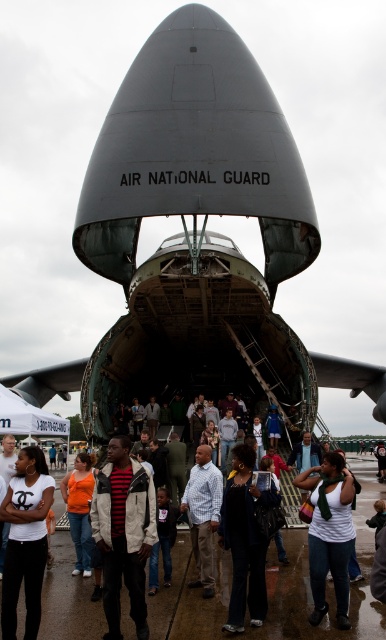
Question: Does white cotton t-shirt at center have a lesser width compared to orange fabric shirt at lower left?

Choices:
 (A) no
 (B) yes

Answer: (A)

Question: Can you confirm if metallic gray aircraft at center is positioned to the left of striped knit sweater at center?

Choices:
 (A) no
 (B) yes

Answer: (A)

Question: Which object appears farthest from the camera in this image?

Choices:
 (A) blue plaid shirt at center
 (B) metallic gray aircraft at center
 (C) white matte shirt at center

Answer: (B)

Question: Can you confirm if shiny asphalt tarmac at center is positioned above white matte shirt at center?

Choices:
 (A) yes
 (B) no

Answer: (B)

Question: Which object appears closest to the camera in this image?

Choices:
 (A) white cotton t-shirt at center
 (B) blue plaid shirt at center
 (C) orange fabric shirt at lower left
 (D) shiny asphalt tarmac at center

Answer: (A)

Question: Among these objects, which one is nearest to the camera?

Choices:
 (A) white matte shirt at center
 (B) blue plaid shirt at center
 (C) shiny asphalt tarmac at center

Answer: (C)